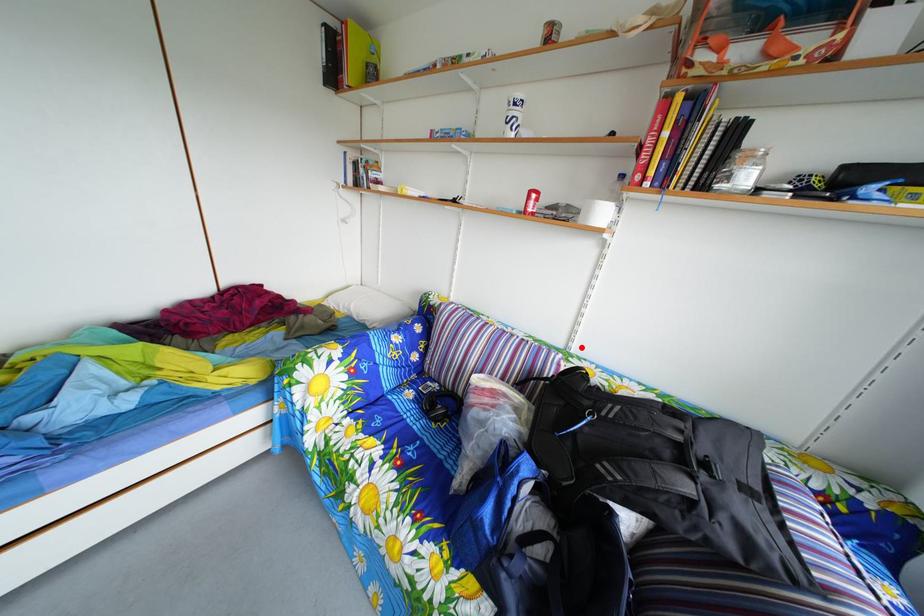
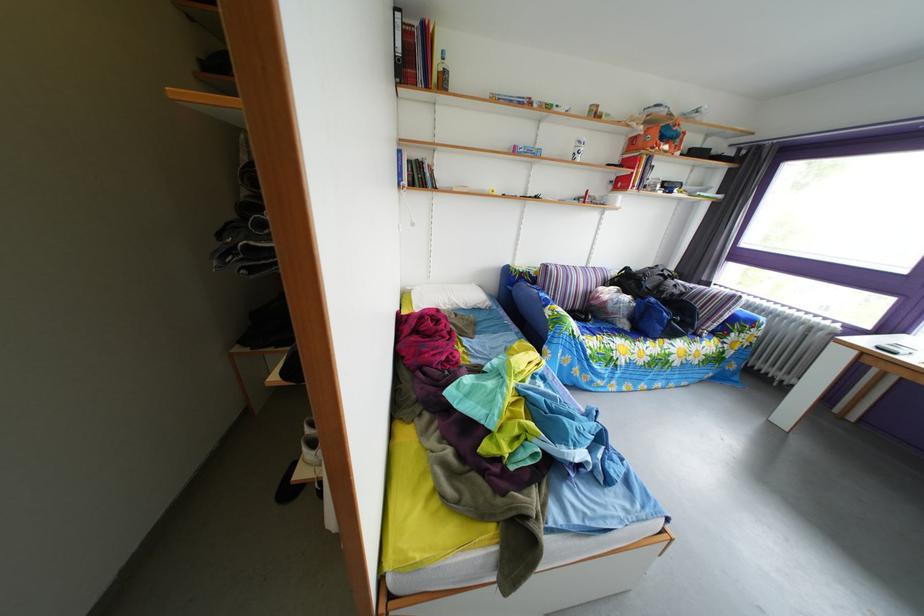
Where in the second image is the point corresponding to the highlighted location from the first image?

(599, 270)